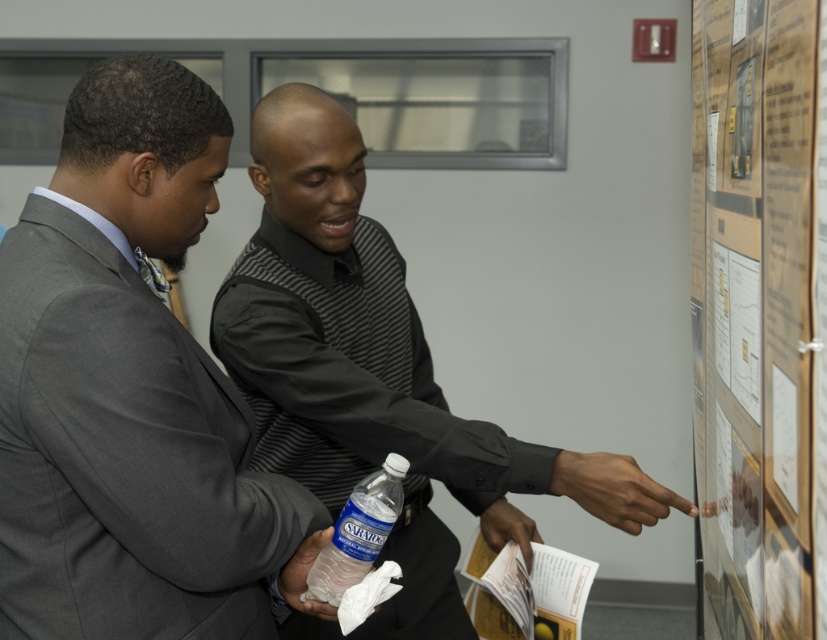
You are standing in the room and want to move from the point at coordinates point (x=92, y=148) to the point at coordinates point (x=370, y=493). Is the destination point closer to the wall with the window or the informational board?

The point at coordinates point (x=92, y=148) is in front of point (x=370, y=493). Since the informational board is on the wall, the destination point (x=370, y=493) is closer to the wall with the window.

You are a photographer setting up for a group photo. You need to ensure that the black matte shirt at center and the paperboard poster at right are both in focus. The camera you are using has a depth of field that can cover 20 inches. Can both subjects be in focus at the same time?

The distance between the black matte shirt at center and the paperboard poster at right is 19.65 inches, which is within the camera depth of field of 20 inches. Therefore, both subjects can be in focus simultaneously.